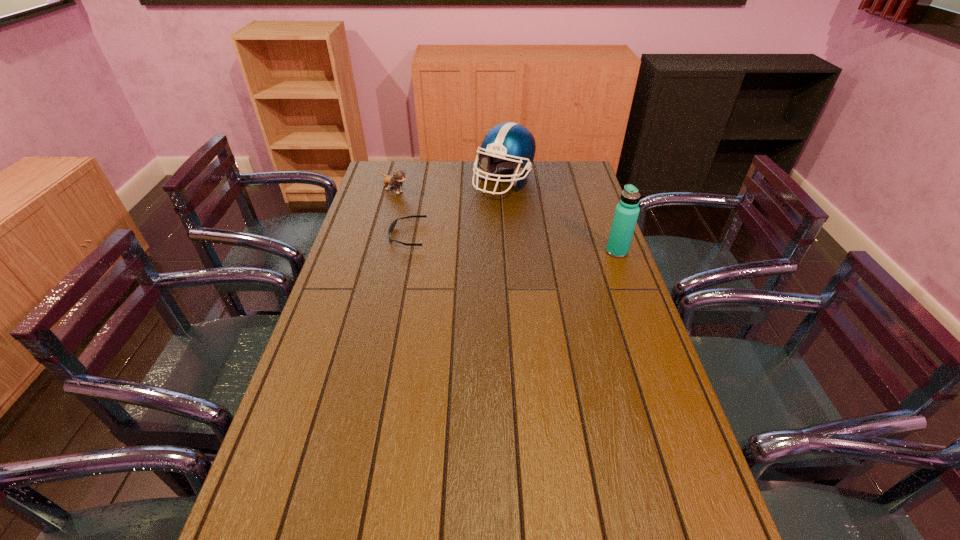
Find the location of a particular element. Image resolution: width=960 pixels, height=540 pixels. sunglasses is located at coordinates (393, 224).

Find the location of a particular element. The width and height of the screenshot is (960, 540). water bottle is located at coordinates (627, 211).

Identify the location of kitten. (395, 181).

Locate an element on the screen. Image resolution: width=960 pixels, height=540 pixels. football helmet is located at coordinates (507, 145).

Find the location of a particular element. Image resolution: width=960 pixels, height=540 pixels. free space located 0.080m on the front-facing side of the sunglasses is located at coordinates (367, 235).

Locate an element on the screen. vacant area located 0.310m on the back of the rightmost object is located at coordinates (597, 197).

I want to click on vacant space situated on the front-facing side of the kitten, so click(x=468, y=223).

The width and height of the screenshot is (960, 540). What are the coordinates of `vacant position located 0.090m on the front-facing side of the kitten` in the screenshot? It's located at (422, 202).

The height and width of the screenshot is (540, 960). What are the coordinates of `free spot located on the front-facing side of the kitten` in the screenshot? It's located at (436, 208).

This screenshot has height=540, width=960. I want to click on vacant space located at the front of the football helmet with the faceguard, so 536,261.